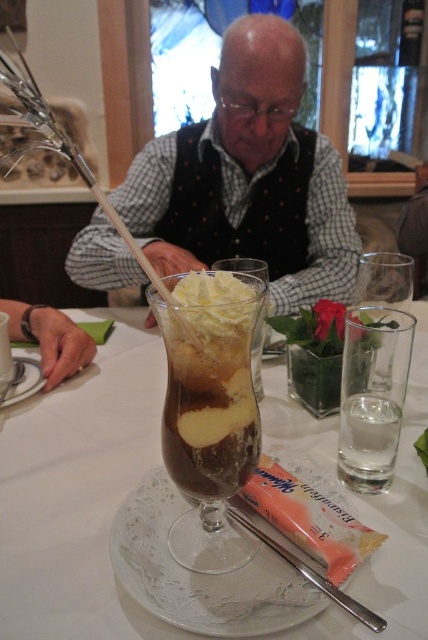
Based on the photo, you are a food critic who wants to describe the presentation of the chocolate gelatinous dessert at center and the white lace plate at center. Which object has a smaller width?

The chocolate gelatinous dessert at center has a smaller width than the white lace plate at center.

You are a diner who just arrived at the table. You see the silver metallic chopstick at lower center and the white porcelain plate at lower left. Which object is larger?

The silver metallic chopstick at lower center is bigger than the white porcelain plate at lower left.

You are a customer at a diner and you want to order the chocolate gelatinous dessert at center. The waiter tells you that the dessert is placed at coordinates point (211, 394). Can you confirm if this point is where the dessert is located?

Yes, the point (211, 394) corresponds to the chocolate gelatinous dessert at center, so the dessert is indeed located at that coordinate.